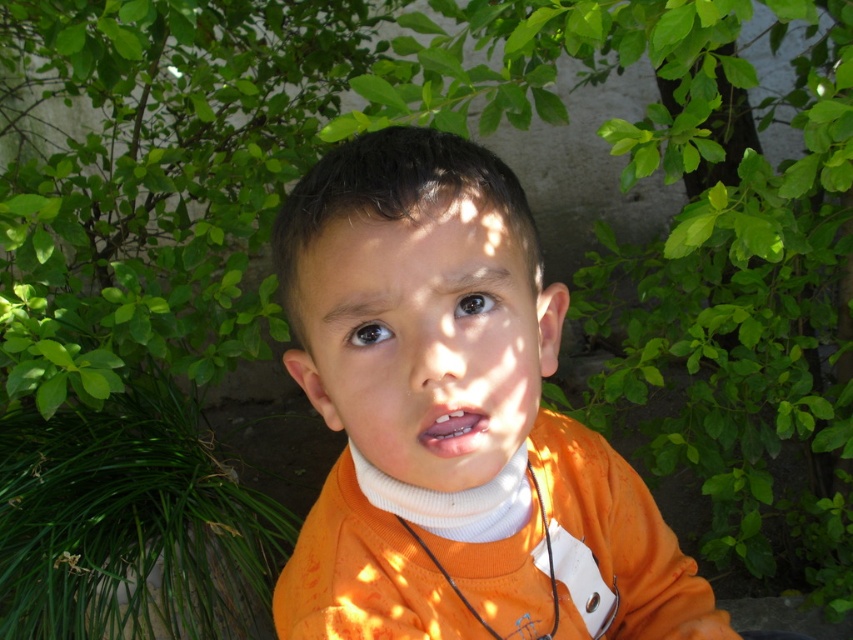
Does orange fabric shirt at center have a smaller size compared to orange matte shirt at center?

No, orange fabric shirt at center is not smaller than orange matte shirt at center.

The image size is (853, 640). What are the coordinates of `orange fabric shirt at center` in the screenshot? It's located at (450, 404).

Is point (372, 435) farther from camera compared to point (413, 378)?

That is True.

Where is `orange fabric shirt at center`? This screenshot has width=853, height=640. orange fabric shirt at center is located at coordinates (450, 404).

Who is shorter, orange fabric shirt at center or matte orange mouth at center?

matte orange mouth at center

Does orange fabric shirt at center appear under matte orange mouth at center?

Indeed, orange fabric shirt at center is positioned under matte orange mouth at center.

Who is more forward, (405,403) or (471,422)?

Point (405,403) is more forward.

Where is `orange fabric shirt at center`? Image resolution: width=853 pixels, height=640 pixels. orange fabric shirt at center is located at coordinates (450, 404).

Who is positioned more to the left, orange matte shirt at center or matte orange mouth at center?

Positioned to the left is orange matte shirt at center.

Which of these two, orange matte shirt at center or matte orange mouth at center, stands taller?

orange matte shirt at center

Identify the location of orange matte shirt at center. This screenshot has height=640, width=853. (424, 337).